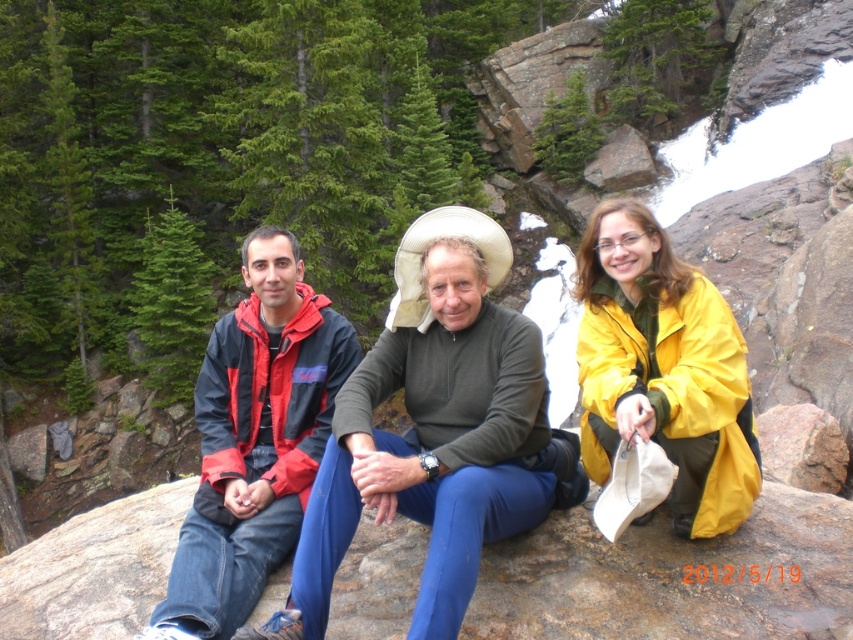
Does red jacket at center appear over red and black jacket at left?

Yes, red jacket at center is above red and black jacket at left.

Is red jacket at center smaller than red and black jacket at left?

Actually, red jacket at center might be larger than red and black jacket at left.

The image size is (853, 640). I want to click on red jacket at center, so click(x=436, y=449).

The image size is (853, 640). What are the coordinates of `red jacket at center` in the screenshot? It's located at (436, 449).

Which is in front, point (264, 394) or point (659, 307)?

Point (659, 307) is more forward.

Can you confirm if red and black jacket at left is smaller than yellow matte jacket at center?

Yes.

Which is behind, point (279, 442) or point (711, 371)?

The point (279, 442) is behind.

Find the location of a particular element. red and black jacket at left is located at coordinates (254, 440).

Who is shorter, red jacket at center or yellow matte jacket at center?

red jacket at center

Which is more to the left, red jacket at center or yellow matte jacket at center?

From the viewer's perspective, red jacket at center appears more on the left side.

This screenshot has width=853, height=640. Find the location of `red jacket at center`. red jacket at center is located at coordinates (436, 449).

Identify the location of red jacket at center. This screenshot has width=853, height=640. (436, 449).